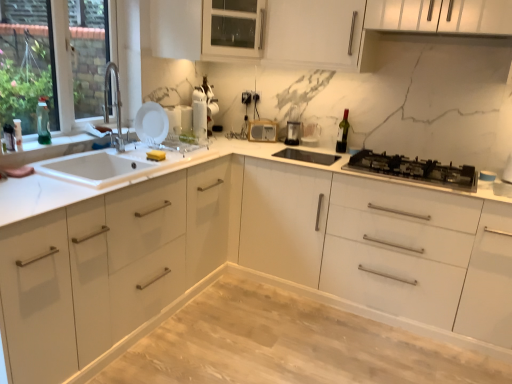
Question: In the image, is white glossy cabinet at center, marked as the first cabinetry in a bottom-to-top arrangement, positioned in front of or behind green glass wine bottle at upper right?

Choices:
 (A) front
 (B) behind

Answer: (A)

Question: From a real-world perspective, is white glossy cabinet at center, arranged as the second cabinetry when viewed from the top, positioned above or below green glass wine bottle at upper right?

Choices:
 (A) below
 (B) above

Answer: (A)

Question: Which object is the closest to the black plastic coffee maker at center, which appears as the 4th appliance when viewed from the left?

Choices:
 (A) light wood/dark stain dining table at center
 (B) wooden radio at center, positioned as the 4th appliance in front-to-back order
 (C) clear glass window at left
 (D) white glossy sink at left
 (E) white glossy kettle at upper center, which is the 3th appliance in right-to-left order

Answer: (B)

Question: Which object is the closest to the green glass wine bottle at upper right?

Choices:
 (A) light wood/dark stain dining table at center
 (B) white glossy cabinet at center, arranged as the second cabinetry when viewed from the top
 (C) clear glass window at left
 (D) white glossy sink at left
 (E) white matte plate at upper left, the 4th appliance positioned from the right

Answer: (E)